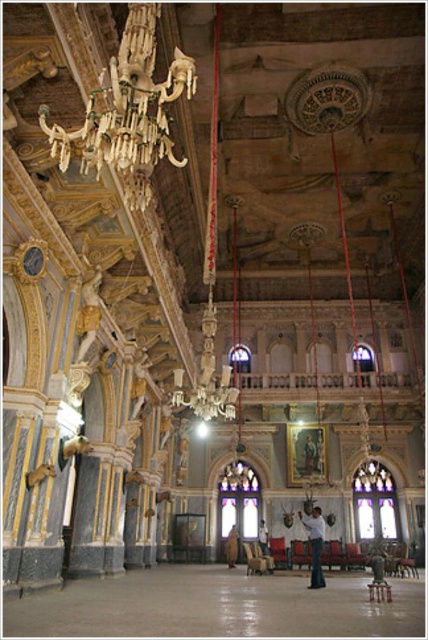
You are standing in the grand hall and want to reach the point marked at coordinates (315, 563). Considering the hall is 60 meters long, can you walk straight to that point without encountering any obstacles?

The point at coordinates (315, 563) is 53.48 meters away from you. Since the hall is 60 meters long, you can walk straight to that point without encountering any obstacles as the distance is within the hall length.

You are standing in the grand hall and want to move from the point closer to you to the one further away. Which path would you take between the two points, point (323, 524) and point (306, 468)?

You should move from point (323, 524) to point (306, 468) since point (323, 524) is closer to you and you want to go to the point further away.